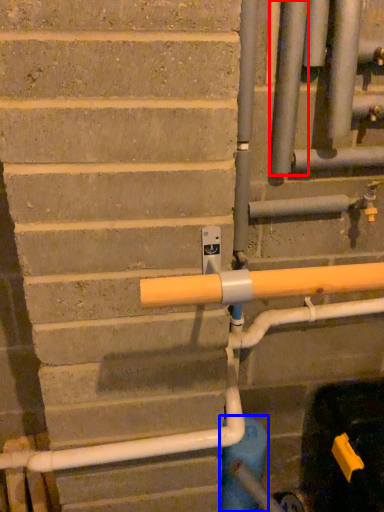
Question: Which of the following is the closest to the observer, pipe (highlighted by a red box) or water pipe (highlighted by a blue box)?

Choices:
 (A) pipe
 (B) water pipe

Answer: (A)